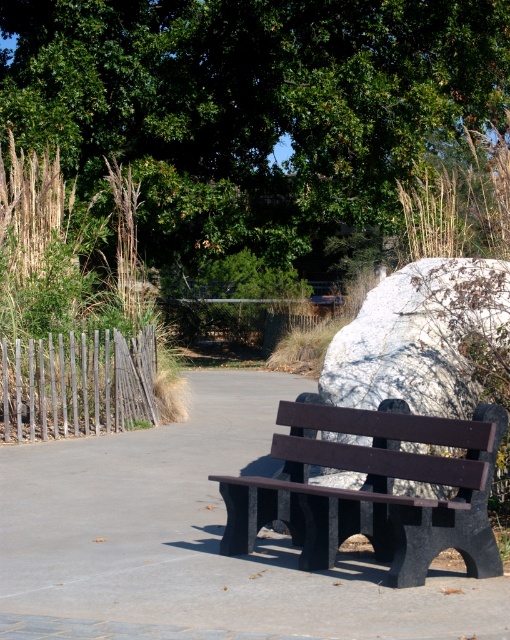
Between point (28, 513) and point (461, 284), which one is positioned behind?

The point (28, 513) is more distant.

Can you confirm if dark gray concrete bench at center is wider than white marble boulder at center right?

Correct, the width of dark gray concrete bench at center exceeds that of white marble boulder at center right.

Who is more distant from viewer, (37, 506) or (461, 336)?

The point (37, 506) is behind.

Locate an element on the screen. dark gray concrete bench at center is located at coordinates (196, 541).

Can you confirm if green leafy tree at upper center is positioned below white marble boulder at center right?

No, green leafy tree at upper center is not below white marble boulder at center right.

Is green leafy tree at upper center shorter than white marble boulder at center right?

No.

Between point (100, 157) and point (421, 284), which one is positioned behind?

Positioned behind is point (100, 157).

Find the location of `green leafy tree at upper center`. green leafy tree at upper center is located at coordinates (249, 106).

Which is below, dark gray concrete bench at center or matte black bench at center?

dark gray concrete bench at center is lower down.

Does dark gray concrete bench at center come in front of matte black bench at center?

Yes.

Which is behind, point (495, 579) or point (471, 561)?

The point (495, 579) is behind.

The width and height of the screenshot is (510, 640). In order to click on dark gray concrete bench at center in this screenshot , I will do `click(196, 541)`.